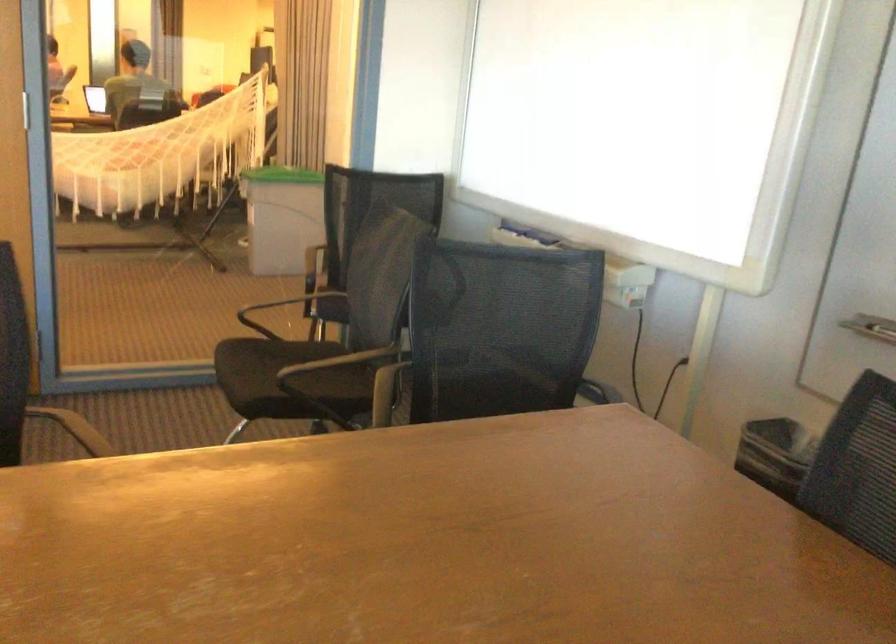
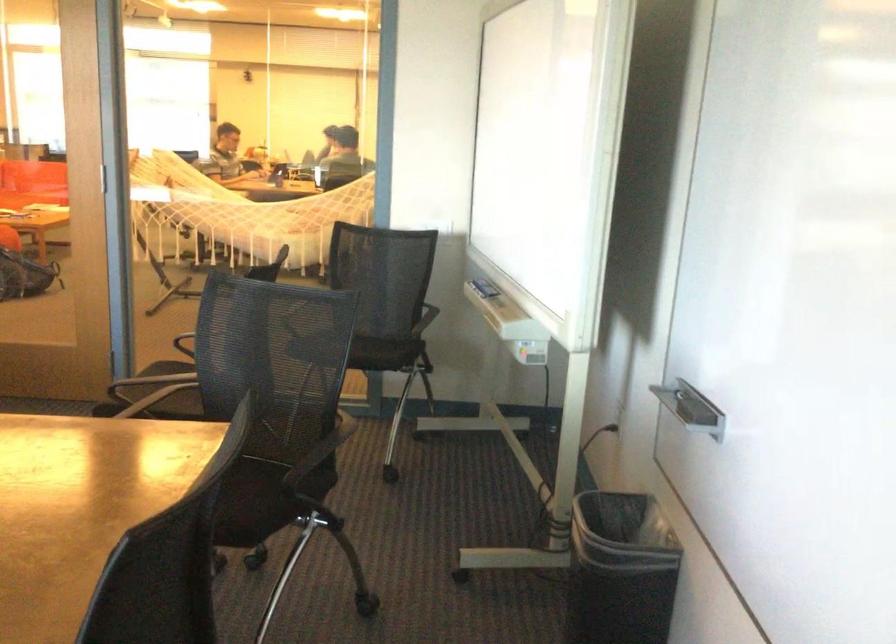
The point at (73, 146) is marked in the first image. Where is the corresponding point in the second image?

(246, 213)